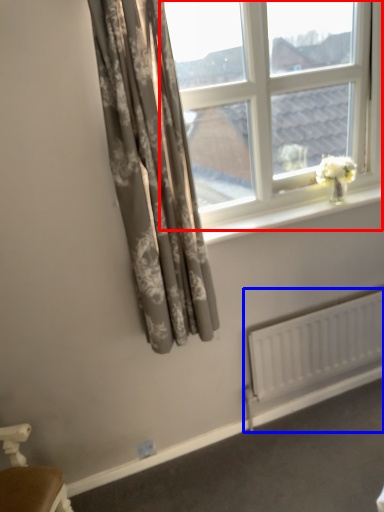
Question: Which of the following is the closest to the observer, window (highlighted by a red box) or radiator (highlighted by a blue box)?

Choices:
 (A) window
 (B) radiator

Answer: (A)